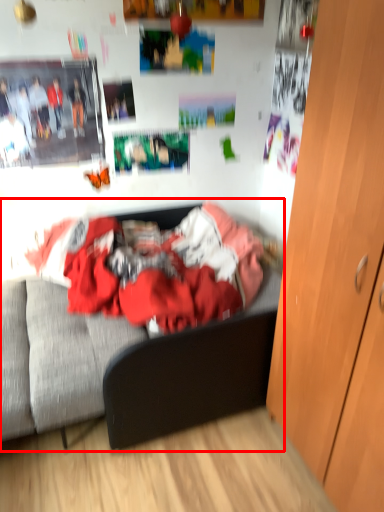
Question: From the image's perspective, considering the relative positions of bed (annotated by the red box) and cabinetry in the image provided, where is bed (annotated by the red box) located with respect to the staircase?

Choices:
 (A) above
 (B) below

Answer: (A)